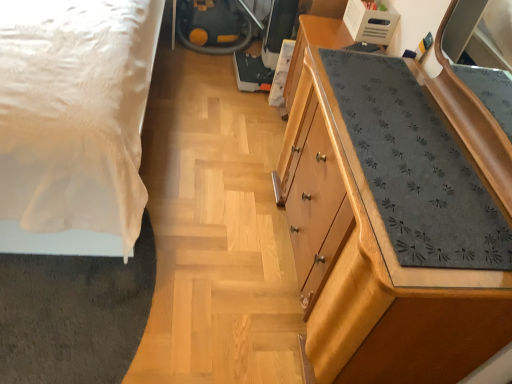
Question: In terms of width, does wooden dresser at right look wider or thinner when compared to white satin bed at left?

Choices:
 (A) thin
 (B) wide

Answer: (A)

Question: Considering the positions of point (462, 125) and point (79, 248), is point (462, 125) closer or farther from the camera than point (79, 248)?

Choices:
 (A) closer
 (B) farther

Answer: (A)

Question: Is wooden dresser at right taller or shorter than white satin bed at left?

Choices:
 (A) short
 (B) tall

Answer: (A)

Question: Considering the positions of white satin bed at left and wooden dresser at right in the image, is white satin bed at left wider or thinner than wooden dresser at right?

Choices:
 (A) wide
 (B) thin

Answer: (A)

Question: From a real-world perspective, is white satin bed at left above or below wooden dresser at right?

Choices:
 (A) below
 (B) above

Answer: (B)

Question: In terms of height, does white satin bed at left look taller or shorter compared to wooden dresser at right?

Choices:
 (A) tall
 (B) short

Answer: (A)

Question: Does point (23, 170) appear closer or farther from the camera than point (369, 213)?

Choices:
 (A) closer
 (B) farther

Answer: (B)